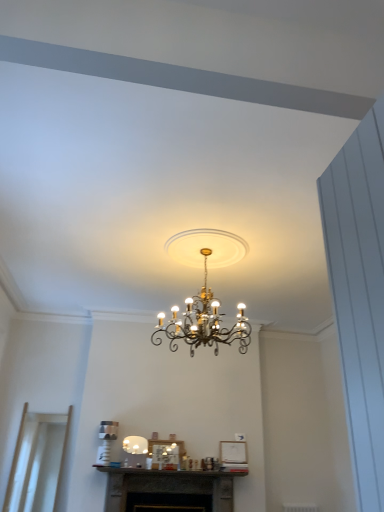
Question: Considering the relative positions of gold metallic chandelier at center, which is the second lamp from bottom to top, and dark gray stone fireplace at center in the image provided, is gold metallic chandelier at center, which is the second lamp from bottom to top, to the right of dark gray stone fireplace at center from the viewer's perspective?

Choices:
 (A) no
 (B) yes

Answer: (B)

Question: Is gold metallic chandelier at center, the 1th lamp positioned from the front, in contact with dark gray stone fireplace at center?

Choices:
 (A) no
 (B) yes

Answer: (A)

Question: From the image's perspective, does gold metallic chandelier at center, which is counted as the 1th lamp, starting from the right, appear higher than dark gray stone fireplace at center?

Choices:
 (A) yes
 (B) no

Answer: (A)

Question: Is the depth of gold metallic chandelier at center, which is counted as the 1th lamp, starting from the right, greater than that of dark gray stone fireplace at center?

Choices:
 (A) no
 (B) yes

Answer: (A)

Question: Is gold metallic chandelier at center, which is counted as the 2th lamp, starting from the left, not inside dark gray stone fireplace at center?

Choices:
 (A) no
 (B) yes

Answer: (B)

Question: Is gold metallic chandelier at center, which is counted as the 2th lamp, starting from the left, not near dark gray stone fireplace at center?

Choices:
 (A) yes
 (B) no

Answer: (A)

Question: Would you say transparent glass door at lower left is a long distance from dark gray stone fireplace at center?

Choices:
 (A) no
 (B) yes

Answer: (B)

Question: Could dark gray stone fireplace at center be considered to be inside transparent glass door at lower left?

Choices:
 (A) yes
 (B) no

Answer: (B)

Question: Does transparent glass door at lower left come behind dark gray stone fireplace at center?

Choices:
 (A) yes
 (B) no

Answer: (A)

Question: From the image's perspective, is transparent glass door at lower left above dark gray stone fireplace at center?

Choices:
 (A) yes
 (B) no

Answer: (A)

Question: Does transparent glass door at lower left have a larger size compared to dark gray stone fireplace at center?

Choices:
 (A) no
 (B) yes

Answer: (A)

Question: Is transparent glass door at lower left positioned beyond the bounds of dark gray stone fireplace at center?

Choices:
 (A) no
 (B) yes

Answer: (B)

Question: From a real-world perspective, is white glossy lampshade at center, placed as the first lamp when sorted from bottom to top, on top of transparent glass door at lower left?

Choices:
 (A) no
 (B) yes

Answer: (B)